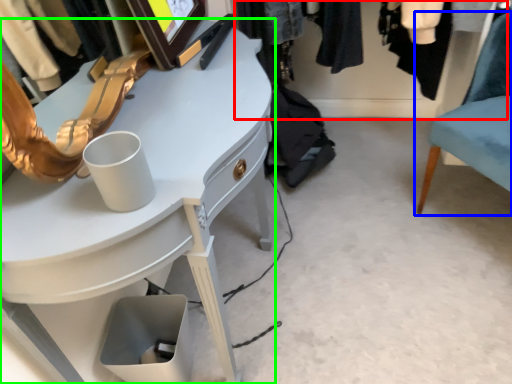
Question: Considering the real-world distances, which object is farthest from closet (highlighted by a red box)? chair (highlighted by a blue box) or desk (highlighted by a green box)?

Choices:
 (A) chair
 (B) desk

Answer: (B)